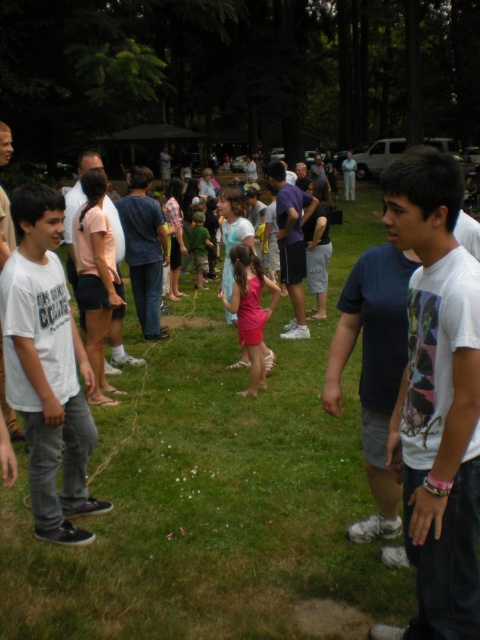
Image resolution: width=480 pixels, height=640 pixels. I want to click on pink satin dress at center, so click(251, 310).

Does pink satin dress at center appear on the right side of green camouflage shirt at center?

Indeed, pink satin dress at center is positioned on the right side of green camouflage shirt at center.

Who is more distant from viewer, (239,275) or (207,232)?

Point (207,232)

Find the location of a particular element. The image size is (480, 640). pink satin dress at center is located at coordinates (251, 310).

At what (x,y) coordinates should I click in order to perform the action: click on white cotton shirt at left. Please return your answer as a coordinate pair (x, y). The width and height of the screenshot is (480, 640). Looking at the image, I should click on (47, 368).

Measure the distance between white cotton shirt at left and camera.

3.09 meters

Where is `white cotton shirt at left`? white cotton shirt at left is located at coordinates (47, 368).

Is point (66, 472) positioned after point (263, 275)?

That is False.

Which is more to the right, white cotton shirt at left or pink satin dress at center?

pink satin dress at center

The width and height of the screenshot is (480, 640). What do you see at coordinates (47, 368) in the screenshot? I see `white cotton shirt at left` at bounding box center [47, 368].

The height and width of the screenshot is (640, 480). Identify the location of white cotton shirt at left. (47, 368).